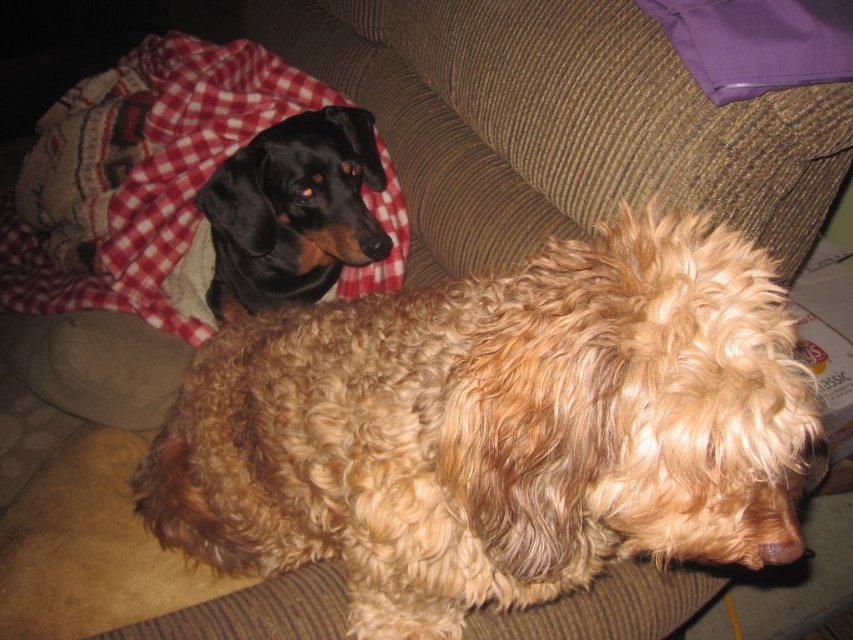
Question: Which object appears closest to the camera in this image?

Choices:
 (A) black shiny dog at upper left
 (B) red checkered blanket at upper left
 (C) curly golden fur dog at center

Answer: (C)

Question: Is red checkered blanket at upper left above black shiny dog at upper left?

Choices:
 (A) no
 (B) yes

Answer: (B)

Question: Can you confirm if red checkered blanket at upper left is smaller than black shiny dog at upper left?

Choices:
 (A) no
 (B) yes

Answer: (A)

Question: Considering the relative positions of curly golden fur dog at center and black shiny dog at upper left in the image provided, where is curly golden fur dog at center located with respect to black shiny dog at upper left?

Choices:
 (A) above
 (B) below

Answer: (B)

Question: Which point is closer to the camera?

Choices:
 (A) curly golden fur dog at center
 (B) black shiny dog at upper left
 (C) red checkered blanket at upper left

Answer: (A)

Question: Among these objects, which one is nearest to the camera?

Choices:
 (A) red checkered blanket at upper left
 (B) black shiny dog at upper left

Answer: (B)